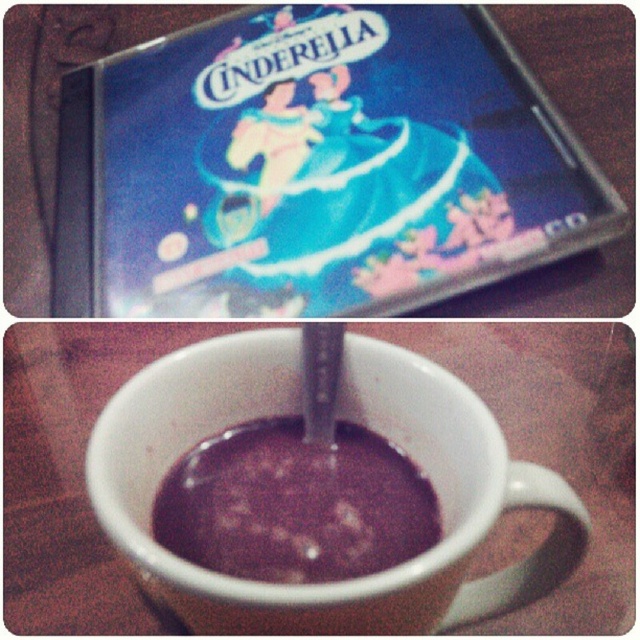
Question: Which point is farther to the camera?

Choices:
 (A) white ceramic mug at center
 (B) dark glossy chocolate at center

Answer: (B)

Question: Which of the following is the farthest from the observer?

Choices:
 (A) (260, 401)
 (B) (344, 432)

Answer: (B)

Question: Is white ceramic mug at center below dark glossy chocolate at center?

Choices:
 (A) no
 (B) yes

Answer: (B)

Question: Is white ceramic mug at center wider than dark glossy chocolate at center?

Choices:
 (A) no
 (B) yes

Answer: (B)

Question: Can you confirm if white ceramic mug at center is thinner than dark glossy chocolate at center?

Choices:
 (A) yes
 (B) no

Answer: (B)

Question: Which of the following is the farthest from the observer?

Choices:
 (A) (128, 436)
 (B) (376, 536)

Answer: (B)